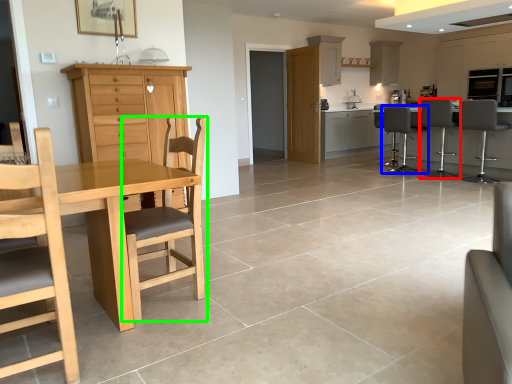
Question: Estimate the real-world distances between objects in this image. Which object is closer to chair (highlighted by a red box), chair (highlighted by a blue box) or chair (highlighted by a green box)?

Choices:
 (A) chair
 (B) chair

Answer: (A)